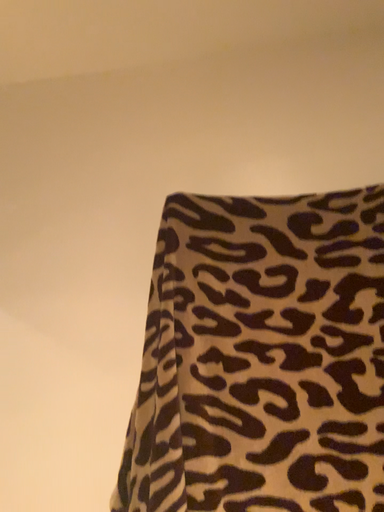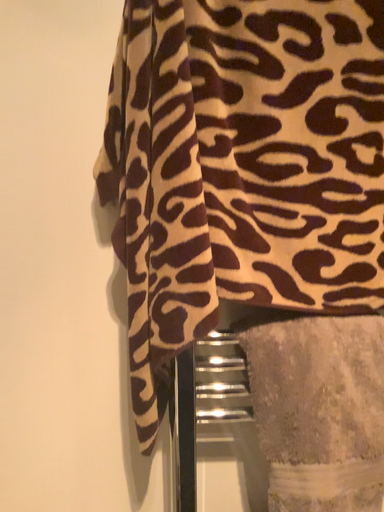
Question: How did the camera likely rotate when shooting the video?

Choices:
 (A) rotated right
 (B) rotated left

Answer: (A)